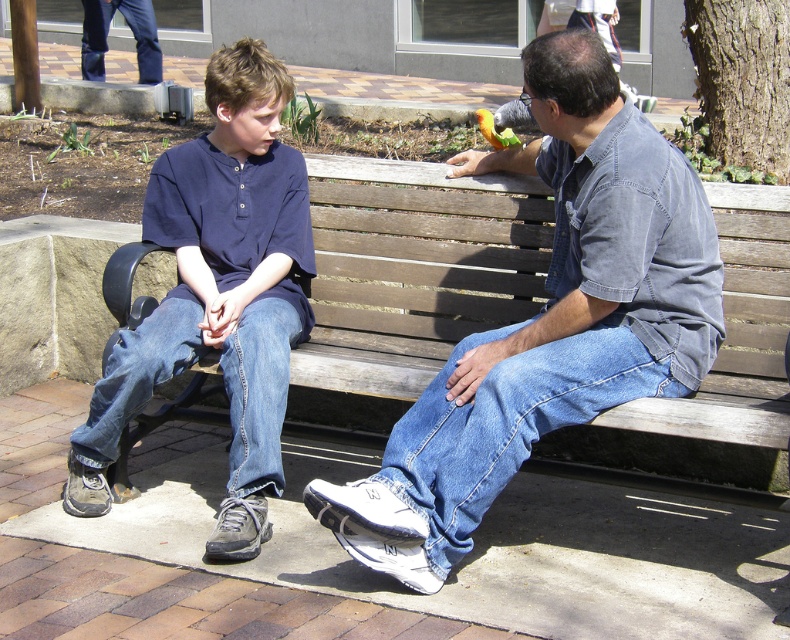
Question: Which of these objects is positioned farthest from the denim jeans at center?

Choices:
 (A) yellow-green parrot at upper center
 (B) gray fabric shirt at upper center

Answer: (B)

Question: Which point is farther to the camera?

Choices:
 (A) (416, 225)
 (B) (96, 513)
 (C) (608, 26)
 (D) (550, 294)

Answer: (C)

Question: Is denim jeans at center above denim jeans at left?

Choices:
 (A) yes
 (B) no

Answer: (B)

Question: Is denim jeans at left bigger than gray fabric shirt at upper center?

Choices:
 (A) yes
 (B) no

Answer: (A)

Question: From the image, what is the correct spatial relationship of denim jeans at left in relation to yellow-green parrot at upper center?

Choices:
 (A) below
 (B) above

Answer: (A)

Question: Estimate the real-world distances between objects in this image. Which object is farther from the dark blue jeans at upper left?

Choices:
 (A) gray fabric shirt at upper center
 (B) yellow-green parrot at upper center
 (C) denim jeans at center

Answer: (C)